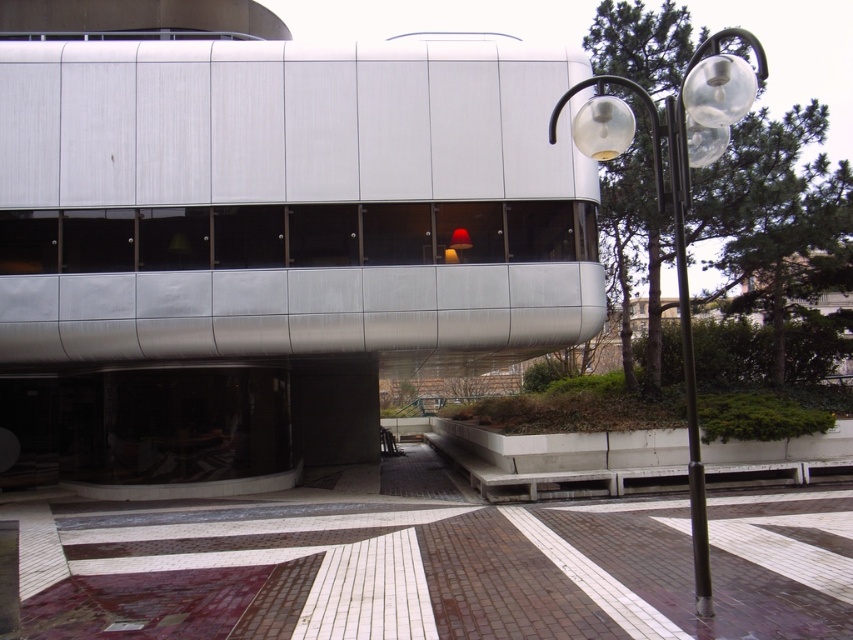
You are a delivery person approaching the entrance of the modern building. You need to park your delivery van on the brown brick pavement at center. However, there is a clear glass lamp post at right nearby. Based on their heights, will the lamp post obstruct the van from parking on the pavement?

The brown brick pavement at center is not as tall as the clear glass lamp post at right, so the lamp post is taller. Since the pavement is lower, the lamp post might not obstruct the van from parking on the pavement as it is elevated or positioned higher, but height alone doesn

You are a delivery person approaching the building and need to park your vehicle near the brown brick pavement at center and the black metal pole at right. Which object should you park closer to if you want to avoid blocking the pathway leading to the entrance?

You should park closer to the brown brick pavement at center because it has a smaller size compared to the black metal pole at right, so it requires less space and is less likely to obstruct the pathway.

You are a pedestrian approaching the entrance of the building and notice the clear glass lamp post at right and the black metal pole at right. Which object is located more to the right side?

The clear glass lamp post at right is positioned on the right side of the black metal pole at right, so it is more to the right.